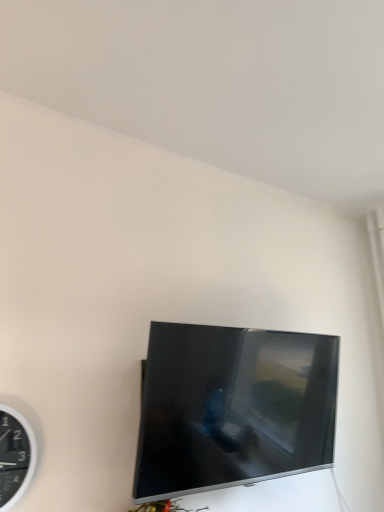
Question: Is the position of black plastic wall clock at left more distant than that of satin black tv at center?

Choices:
 (A) no
 (B) yes

Answer: (A)

Question: Can you confirm if black plastic wall clock at left is positioned to the right of satin black tv at center?

Choices:
 (A) no
 (B) yes

Answer: (A)

Question: From a real-world perspective, does black plastic wall clock at left sit lower than satin black tv at center?

Choices:
 (A) yes
 (B) no

Answer: (A)

Question: From the image's perspective, is black plastic wall clock at left located beneath satin black tv at center?

Choices:
 (A) no
 (B) yes

Answer: (B)

Question: Is satin black tv at center a part of black plastic wall clock at left?

Choices:
 (A) no
 (B) yes

Answer: (A)

Question: Considering the relative sizes of black plastic wall clock at left and satin black tv at center in the image provided, is black plastic wall clock at left wider than satin black tv at center?

Choices:
 (A) no
 (B) yes

Answer: (A)

Question: Considering the relative positions of satin black tv at center and black plastic wall clock at left in the image provided, is satin black tv at center in front of black plastic wall clock at left?

Choices:
 (A) no
 (B) yes

Answer: (A)

Question: From a real-world perspective, is satin black tv at center over black plastic wall clock at left?

Choices:
 (A) yes
 (B) no

Answer: (A)

Question: From a real-world perspective, is satin black tv at center located beneath black plastic wall clock at left?

Choices:
 (A) no
 (B) yes

Answer: (A)

Question: Is satin black tv at center bigger than black plastic wall clock at left?

Choices:
 (A) yes
 (B) no

Answer: (A)

Question: From the image's perspective, is satin black tv at center on top of black plastic wall clock at left?

Choices:
 (A) no
 (B) yes

Answer: (B)

Question: Considering the relative sizes of satin black tv at center and black plastic wall clock at left in the image provided, is satin black tv at center smaller than black plastic wall clock at left?

Choices:
 (A) yes
 (B) no

Answer: (B)

Question: From the image's perspective, is black plastic wall clock at left positioned above or below satin black tv at center?

Choices:
 (A) below
 (B) above

Answer: (A)